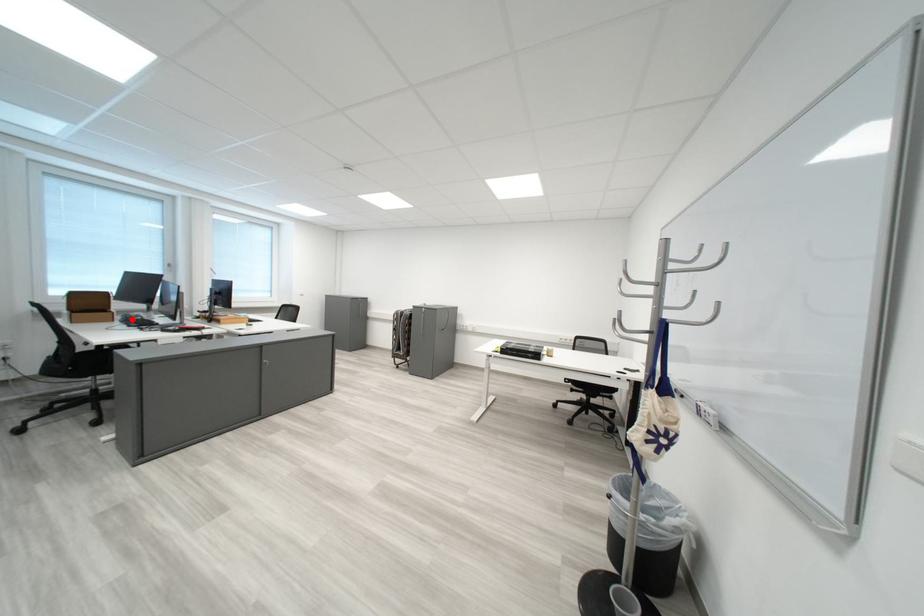
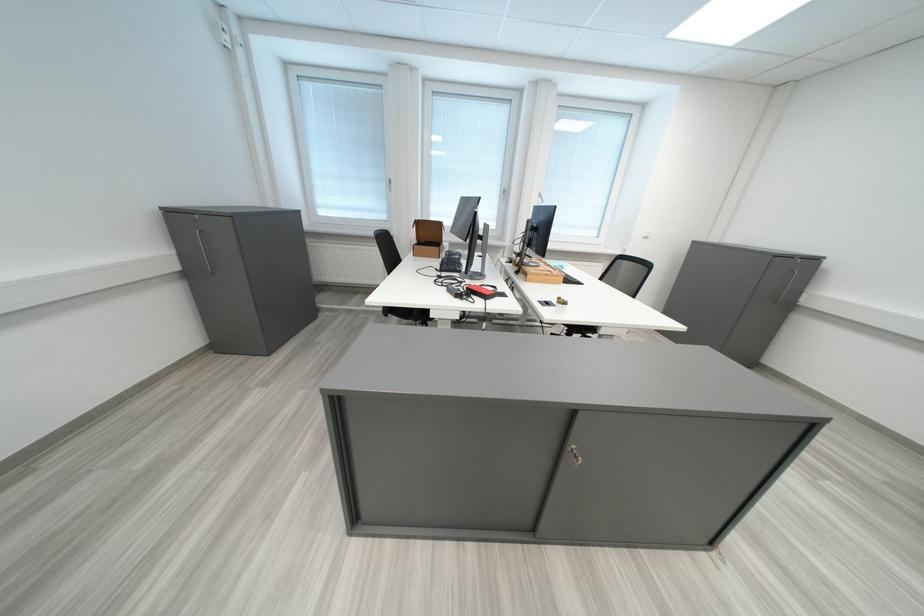
Question: I am providing you with two images of the same scene from different viewpoints. A red point is marked on the first image. Can you still see the location of the red point in image 2?

Choices:
 (A) Yes
 (B) No

Answer: (A)